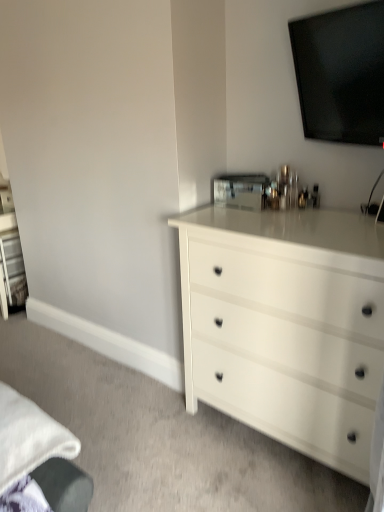
The image size is (384, 512). I want to click on black glossy tv at upper center, so click(x=341, y=74).

This screenshot has height=512, width=384. Describe the element at coordinates (341, 74) in the screenshot. I see `black glossy tv at upper center` at that location.

In order to face black glossy tv at upper center, should I rotate leftwards or rightwards?

To align with it, rotate right about 19.480°.

This screenshot has height=512, width=384. What do you see at coordinates (286, 325) in the screenshot? I see `white glossy chest of drawers at center` at bounding box center [286, 325].

Locate an element on the screen. The height and width of the screenshot is (512, 384). white glossy chest of drawers at center is located at coordinates (286, 325).

This screenshot has width=384, height=512. Identify the location of black glossy tv at upper center. (341, 74).

Can you confirm if white glossy chest of drawers at center is positioned to the right of black glossy tv at upper center?

Incorrect, white glossy chest of drawers at center is not on the right side of black glossy tv at upper center.

Considering their positions, is white glossy chest of drawers at center located in front of or behind black glossy tv at upper center?

In the image, white glossy chest of drawers at center appears in front of black glossy tv at upper center.

Is point (320, 267) farther from viewer compared to point (362, 106)?

No, (320, 267) is in front of (362, 106).

From the image's perspective, who appears lower, white glossy chest of drawers at center or black glossy tv at upper center?

white glossy chest of drawers at center appears lower in the image.

From a real-world perspective, is white glossy chest of drawers at center on top of black glossy tv at upper center?

No.

Considering the sizes of white glossy chest of drawers at center and black glossy tv at upper center in the image, is white glossy chest of drawers at center wider or thinner than black glossy tv at upper center?

Clearly, white glossy chest of drawers at center has more width compared to black glossy tv at upper center.

Looking at this image, considering the relative sizes of white glossy chest of drawers at center and black glossy tv at upper center in the image provided, is white glossy chest of drawers at center taller than black glossy tv at upper center?

Indeed, white glossy chest of drawers at center has a greater height compared to black glossy tv at upper center.

Does white glossy chest of drawers at center have a larger size compared to black glossy tv at upper center?

Correct, white glossy chest of drawers at center is larger in size than black glossy tv at upper center.

Do you think white glossy chest of drawers at center is within black glossy tv at upper center, or outside of it?

white glossy chest of drawers at center exists outside the volume of black glossy tv at upper center.

Is white glossy chest of drawers at center with black glossy tv at upper center?

No, white glossy chest of drawers at center is not with black glossy tv at upper center.

Is white glossy chest of drawers at center oriented towards black glossy tv at upper center?

No, white glossy chest of drawers at center is not aimed at black glossy tv at upper center.

What's the angular difference between white glossy chest of drawers at center and black glossy tv at upper center's facing directions?

The angular difference between white glossy chest of drawers at center and black glossy tv at upper center is 15.1 degrees.

Where is `television on the right of the white glossy chest of drawers at center`? television on the right of the white glossy chest of drawers at center is located at coordinates (341, 74).

Considering the relative positions of black glossy tv at upper center and white glossy chest of drawers at center in the image provided, is black glossy tv at upper center to the left of white glossy chest of drawers at center from the viewer's perspective?

No, black glossy tv at upper center is not to the left of white glossy chest of drawers at center.

Who is more distant, black glossy tv at upper center or white glossy chest of drawers at center?

black glossy tv at upper center is more distant.

Does point (374, 133) appear closer or farther from the camera than point (238, 251)?

Point (374, 133) is closer to the camera than point (238, 251).

From the image's perspective, between black glossy tv at upper center and white glossy chest of drawers at center, who is located below?

white glossy chest of drawers at center is shown below in the image.

From a real-world perspective, is black glossy tv at upper center positioned over white glossy chest of drawers at center based on gravity?

Correct, in the physical world, black glossy tv at upper center is higher than white glossy chest of drawers at center.

Which of these two, black glossy tv at upper center or white glossy chest of drawers at center, is wider?

With larger width is white glossy chest of drawers at center.

From their relative heights in the image, would you say black glossy tv at upper center is taller or shorter than white glossy chest of drawers at center?

black glossy tv at upper center is shorter than white glossy chest of drawers at center.

In terms of size, does black glossy tv at upper center appear bigger or smaller than white glossy chest of drawers at center?

Considering their sizes, black glossy tv at upper center takes up less space than white glossy chest of drawers at center.

Is white glossy chest of drawers at center inside black glossy tv at upper center?

Definitely not — white glossy chest of drawers at center is not inside black glossy tv at upper center.

Is there a large distance between black glossy tv at upper center and white glossy chest of drawers at center?

black glossy tv at upper center is near white glossy chest of drawers at center, not far away.

Is white glossy chest of drawers at center at the back of black glossy tv at upper center?

black glossy tv at upper center does not have its back to white glossy chest of drawers at center.

Can you tell me how much black glossy tv at upper center and white glossy chest of drawers at center differ in facing direction?

15.1 degrees.

Locate an element on the screen. The height and width of the screenshot is (512, 384). the chest of drawers directly beneath the black glossy tv at upper center (from a real-world perspective) is located at coordinates coord(286,325).

Find the location of a particular element. The width and height of the screenshot is (384, 512). television on the right of white glossy chest of drawers at center is located at coordinates (341, 74).

Find the location of a particular element. The height and width of the screenshot is (512, 384). chest of drawers below the black glossy tv at upper center (from a real-world perspective) is located at coordinates (286, 325).